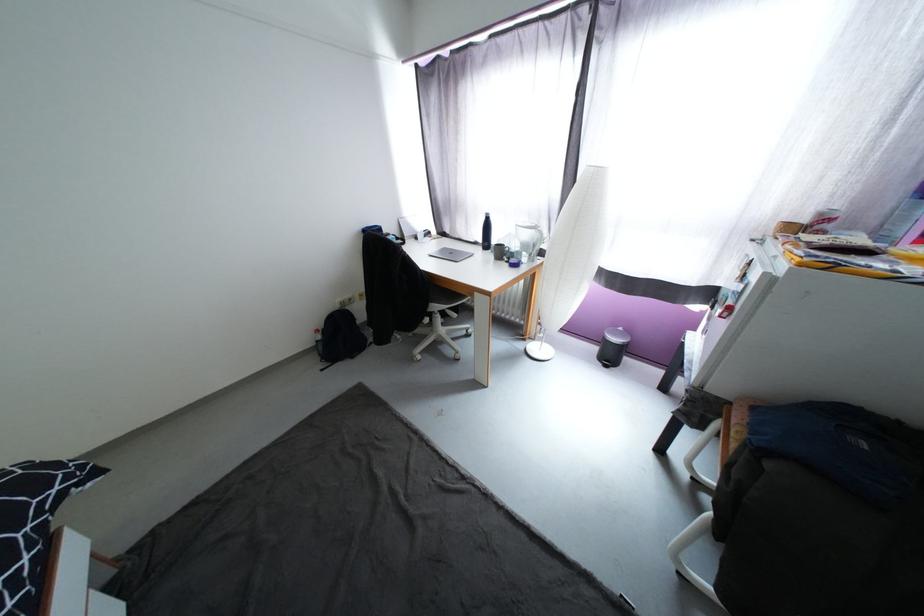
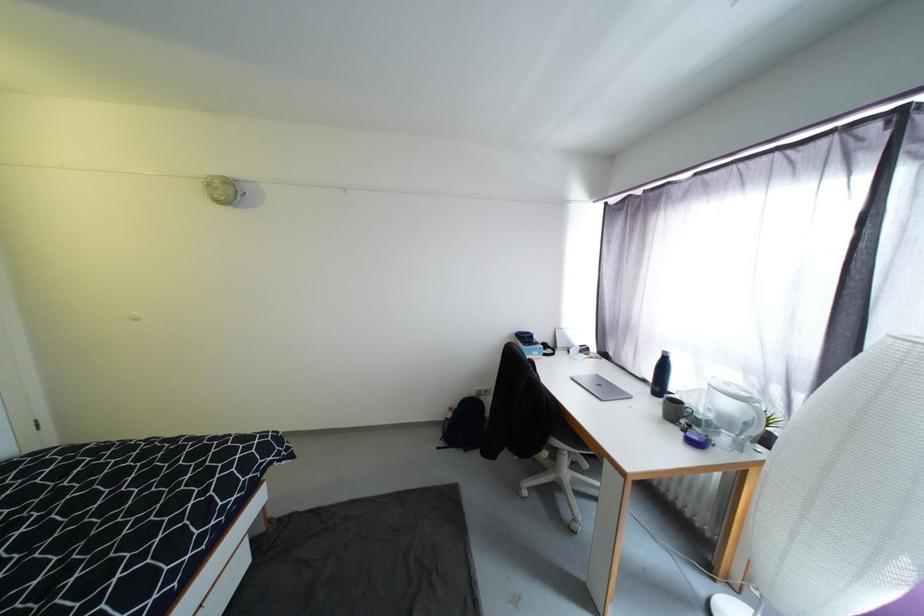
Question: The camera is either moving clockwise (left) or counter-clockwise (right) around the object. The first image is from the beginning of the video and the second image is from the end. Is the camera moving left or right when shooting the video?

Choices:
 (A) Left
 (B) Right

Answer: (B)